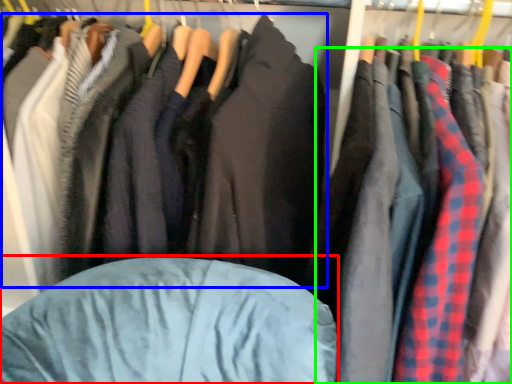
Question: Which object is positioned closest to bean bag chair (highlighted by a red box)? Select from jacket (highlighted by a blue box) and clothing (highlighted by a green box).

Choices:
 (A) jacket
 (B) clothing

Answer: (A)